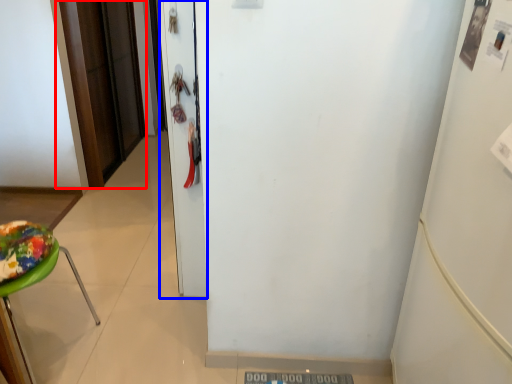
Question: Which point is further to the camera, door (highlighted by a red box) or door (highlighted by a blue box)?

Choices:
 (A) door
 (B) door

Answer: (A)